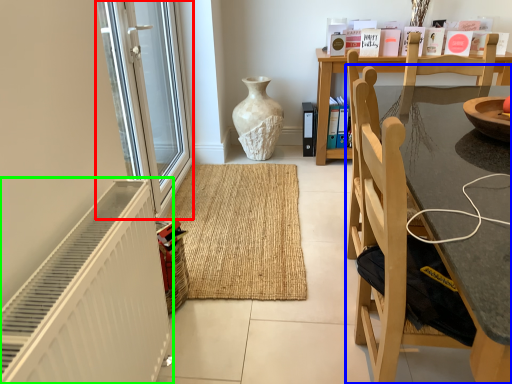
Question: Which is nearer to the screen door (highlighted by a red box)? chair (highlighted by a blue box) or radiator (highlighted by a green box).

Choices:
 (A) chair
 (B) radiator

Answer: (B)